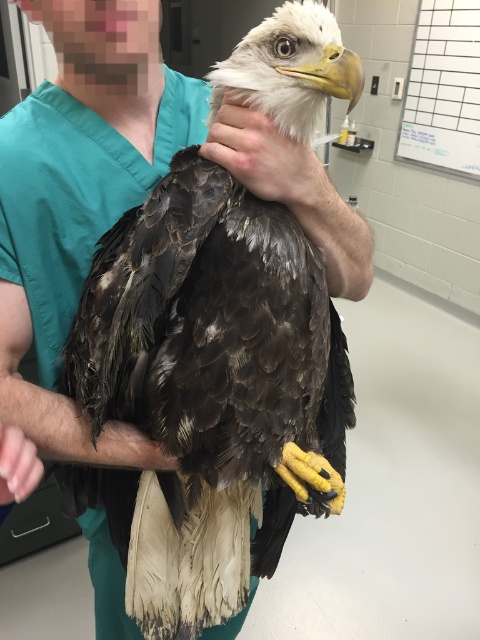
You are a researcher analyzing the image of a person holding a bird in a clinical setting. The coordinates point to an object in the image. Which object is located at point (205,390)?

The point (205,390) marks the brown feathered eagle at center.

You are a medical professional in the veterinary clinic. You need to place a new medical chart on the wall between the two points labeled point (136, 285) and point (12, 445). Where should you place it so that it is closer to the point that is behind the other point?

The medical chart should be placed closer to point (136, 285) because it is behind point (12, 445), so placing it near the back point ensures it is accessible from the front without obstruction.

Based on the photo, you are a medical professional in the scene and need to determine which part is larger between the smooth skin hand at center and the pink flesh at lower left. Based on the description, which one is bigger?

The smooth skin hand at center is bigger than the pink flesh at lower left.